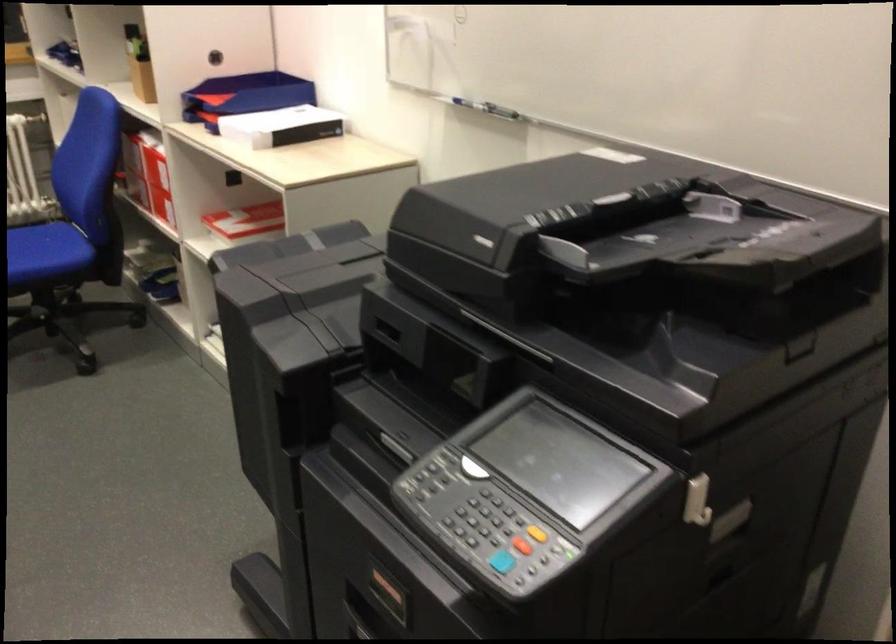
Identify the location of printer side handle. (696, 500).